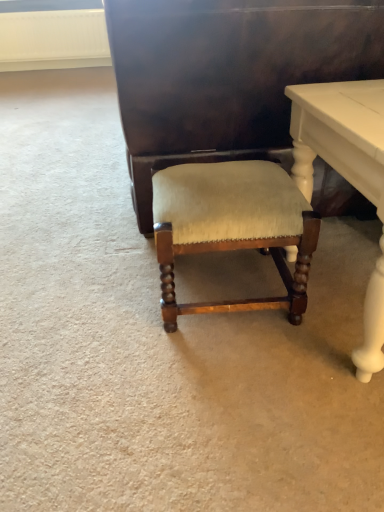
Measure the distance between point (353,183) and camera.

Point (353,183) is 33.58 inches away from camera.

What do you see at coordinates (228, 75) in the screenshot? This screenshot has height=512, width=384. I see `shiny dark wood vanity at center` at bounding box center [228, 75].

Find the location of a particular element. The height and width of the screenshot is (512, 384). white glossy table at lower right is located at coordinates (347, 173).

Can you confirm if shiny dark wood vanity at center is wider than suede-like beige cushion at center?

Correct, the width of shiny dark wood vanity at center exceeds that of suede-like beige cushion at center.

From a real-world perspective, relative to suede-like beige cushion at center, is shiny dark wood vanity at center vertically above or below?

Clearly, from a real-world perspective, shiny dark wood vanity at center is above suede-like beige cushion at center.

Does suede-like beige cushion at center have a greater height compared to shiny dark wood vanity at center?

Incorrect, the height of suede-like beige cushion at center is not larger of that of shiny dark wood vanity at center.

In the scene shown: Between suede-like beige cushion at center and shiny dark wood vanity at center, which one has larger width?

With larger width is shiny dark wood vanity at center.

Find the location of a particular element. The image size is (384, 512). vanity above the suede-like beige cushion at center (from the image's perspective) is located at coordinates (228, 75).

Can shiny dark wood vanity at center be found inside suede-like beige cushion at center?

No, shiny dark wood vanity at center is not a part of suede-like beige cushion at center.

Consider the image. Is white glossy table at lower right wider than shiny dark wood vanity at center?

Incorrect, the width of white glossy table at lower right does not surpass that of shiny dark wood vanity at center.

Where is `table in front of the shiny dark wood vanity at center`? The height and width of the screenshot is (512, 384). table in front of the shiny dark wood vanity at center is located at coordinates (347, 173).

Which is in front, white glossy table at lower right or shiny dark wood vanity at center?

white glossy table at lower right is closer to the camera.

Considering the points (366, 63) and (327, 85), which point is behind, point (366, 63) or point (327, 85)?

The point (366, 63) is more distant.

Is shiny dark wood vanity at center beside white glossy table at lower right?

No.

How much distance is there between shiny dark wood vanity at center and white glossy table at lower right?

They are 25.35 centimeters apart.

Does shiny dark wood vanity at center have a smaller size compared to white glossy table at lower right?

Actually, shiny dark wood vanity at center might be larger than white glossy table at lower right.

Is suede-like beige cushion at center with white glossy table at lower right?

No, suede-like beige cushion at center is not next to white glossy table at lower right.

Which is less distant, (245, 223) or (351, 108)?

The point (351, 108) is more forward.

Where is `table in front of the suede-like beige cushion at center`? The width and height of the screenshot is (384, 512). table in front of the suede-like beige cushion at center is located at coordinates (347, 173).

What's the angular difference between white glossy table at lower right and suede-like beige cushion at center's facing directions?

1.68 degrees.

Considering the positions of point (363, 123) and point (168, 252), is point (363, 123) closer or farther from the camera than point (168, 252)?

Point (363, 123) is closer to the camera than point (168, 252).

From the image's perspective, which is above, white glossy table at lower right or suede-like beige cushion at center?

white glossy table at lower right.

Is white glossy table at lower right looking in the opposite direction of suede-like beige cushion at center?

No, white glossy table at lower right's orientation is not away from suede-like beige cushion at center.

Find the location of a particular element. chair in front of the shiny dark wood vanity at center is located at coordinates (231, 226).

Identify the location of vanity above the suede-like beige cushion at center (from the image's perspective). point(228,75).

Considering their positions, is suede-like beige cushion at center positioned closer to white glossy table at lower right than shiny dark wood vanity at center?

Based on the image, suede-like beige cushion at center appears to be nearer to white glossy table at lower right.

Estimate the real-world distances between objects in this image. Which object is closer to shiny dark wood vanity at center, white glossy table at lower right or suede-like beige cushion at center?

white glossy table at lower right is positioned closer to the anchor shiny dark wood vanity at center.

Which object lies further to the anchor point shiny dark wood vanity at center, suede-like beige cushion at center or white glossy table at lower right?

The object further to shiny dark wood vanity at center is suede-like beige cushion at center.

Considering their positions, is shiny dark wood vanity at center positioned further to suede-like beige cushion at center than white glossy table at lower right?

shiny dark wood vanity at center is further to suede-like beige cushion at center.

Estimate the real-world distances between objects in this image. Which object is further from white glossy table at lower right, shiny dark wood vanity at center or suede-like beige cushion at center?

Among the two, shiny dark wood vanity at center is located further to white glossy table at lower right.

Estimate the real-world distances between objects in this image. Which object is closer to suede-like beige cushion at center, white glossy table at lower right or shiny dark wood vanity at center?

Among the two, white glossy table at lower right is located nearer to suede-like beige cushion at center.

The width and height of the screenshot is (384, 512). I want to click on table between shiny dark wood vanity at center and suede-like beige cushion at center from top to bottom, so click(347, 173).